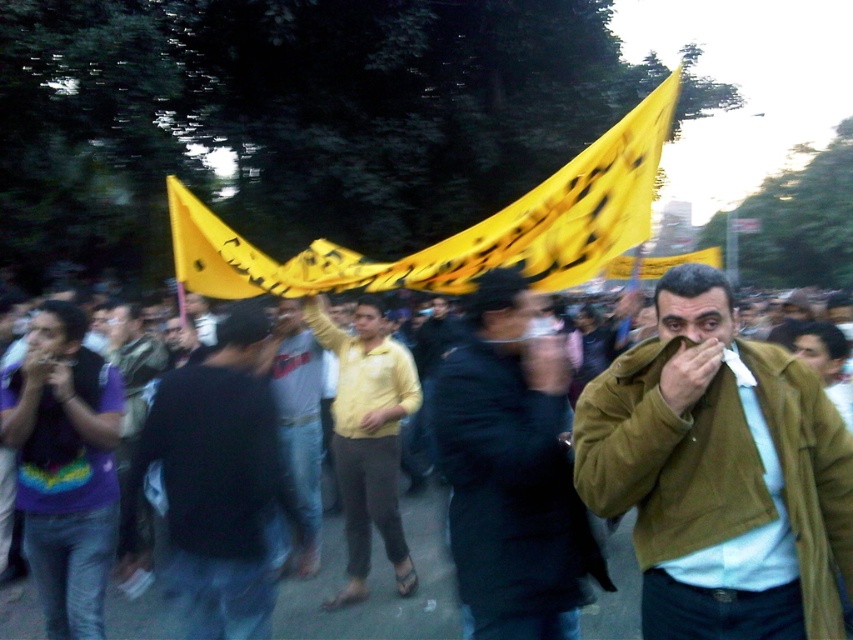
Question: Which point is closer to the camera?

Choices:
 (A) (35, 387)
 (B) (180, 556)
 (C) (283, 436)
 (D) (360, 486)

Answer: (B)

Question: Among these points, which one is nearest to the camera?

Choices:
 (A) (300, 508)
 (B) (102, 600)
 (C) (495, 436)

Answer: (C)

Question: Is dark blue coat at center smaller than yellow fabric banner at upper center?

Choices:
 (A) yes
 (B) no

Answer: (A)

Question: Which object appears farthest from the camera in this image?

Choices:
 (A) yellow matte shirt at center
 (B) black matte shirt at center
 (C) yellow fabric banner at upper center

Answer: (A)

Question: Does yellow matte shirt at center have a lesser width compared to light gray cotton shirt at center?

Choices:
 (A) no
 (B) yes

Answer: (A)

Question: Can you confirm if yellow fabric banner at upper center is wider than purple tie-dye t-shirt at left?

Choices:
 (A) no
 (B) yes

Answer: (B)